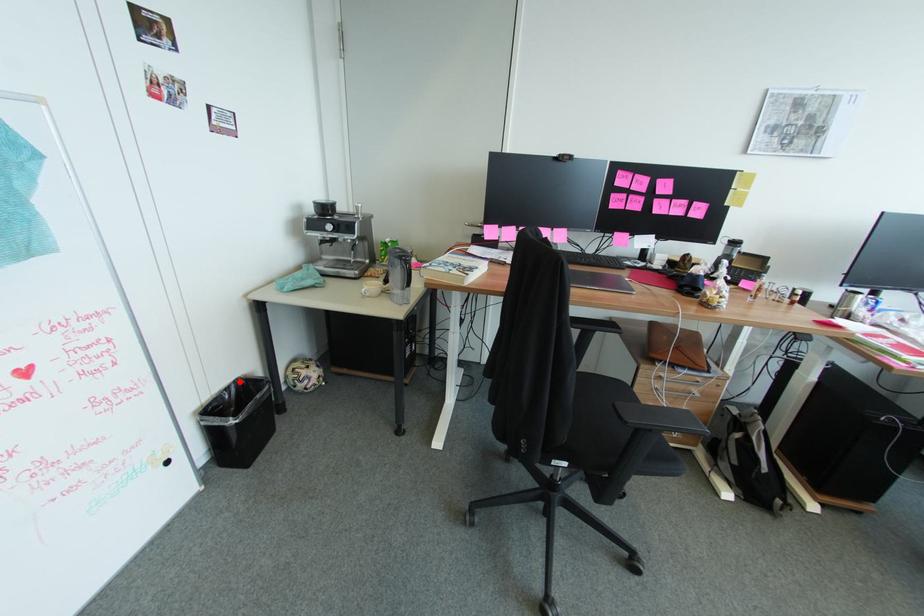
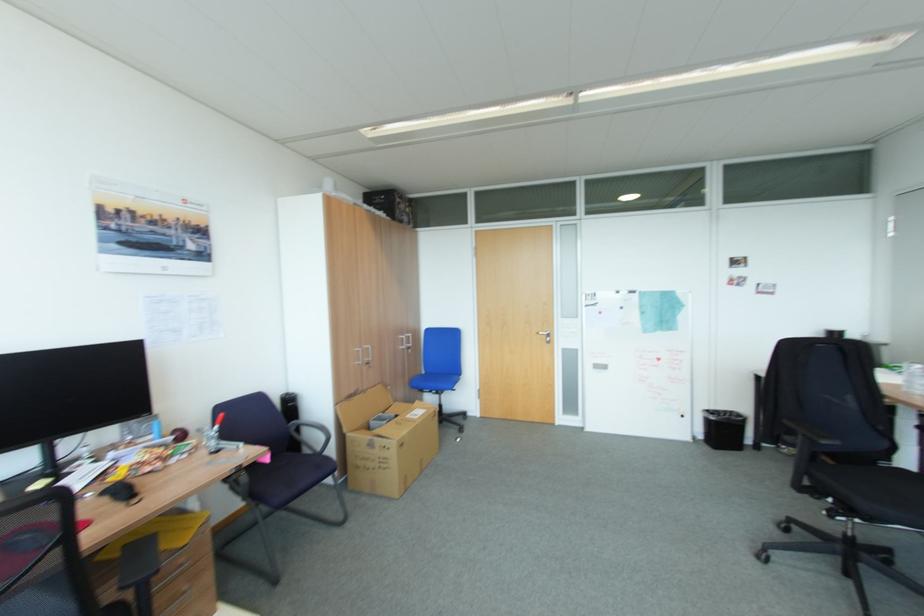
Find the pixel in the second image that matches the highlighted location in the first image.

(736, 411)